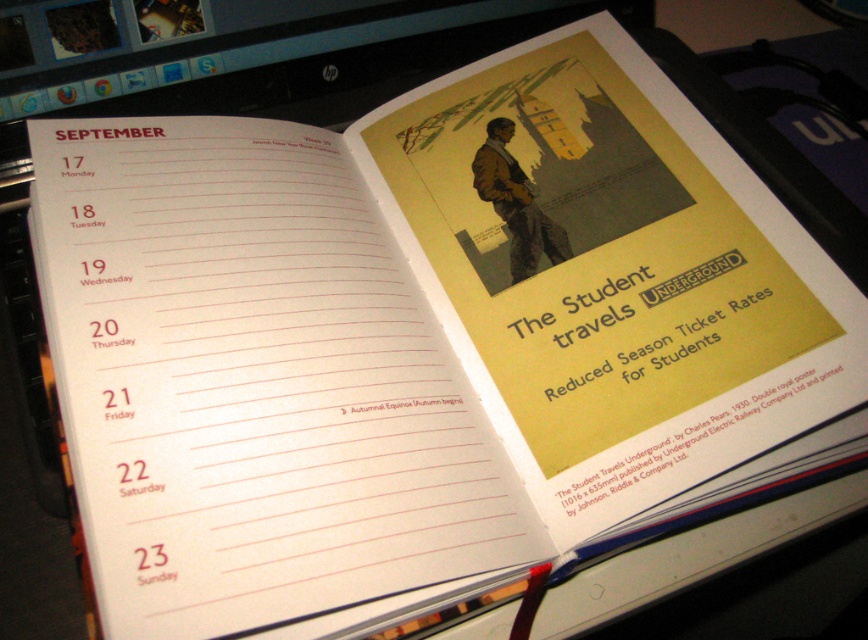
Does point (597, 481) come closer to viewer compared to point (656, 301)?

Yes, point (597, 481) is in front of point (656, 301).

Which is behind, point (674, 433) or point (742, 259)?

The point (742, 259) is behind.

The height and width of the screenshot is (640, 868). What are the coordinates of `yellow paper at upper right` in the screenshot? It's located at (681, 444).